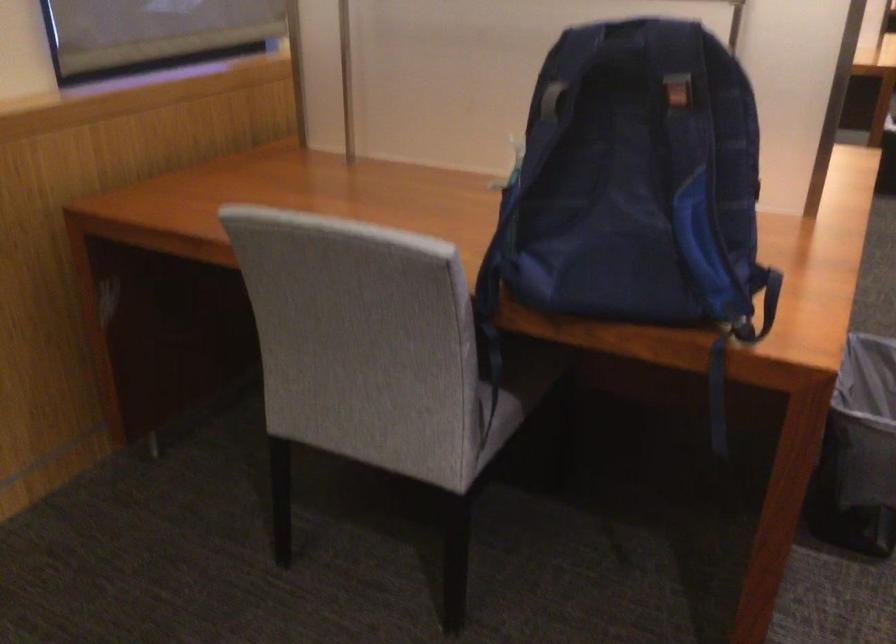
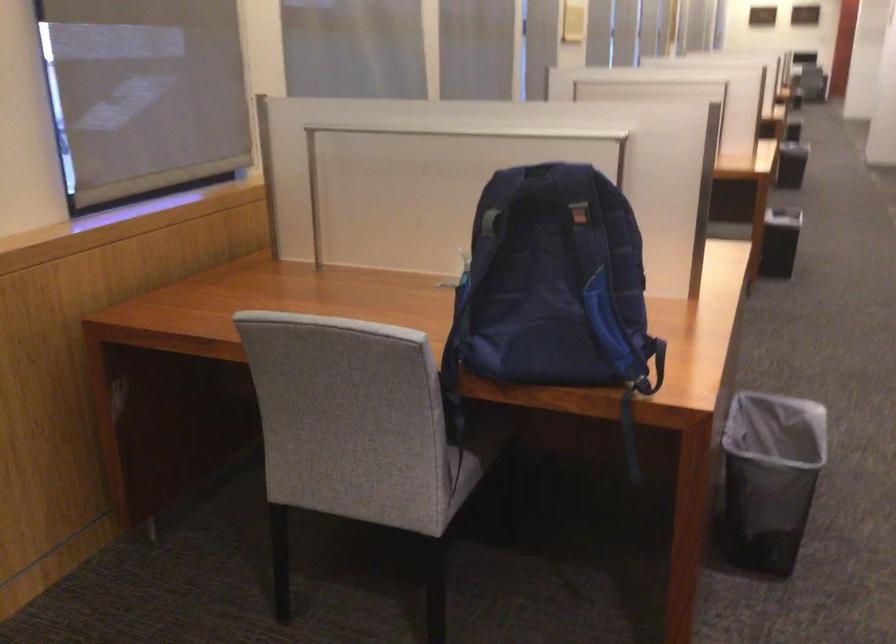
Locate, in the second image, the point that corresponds to (x=631, y=187) in the first image.

(552, 281)